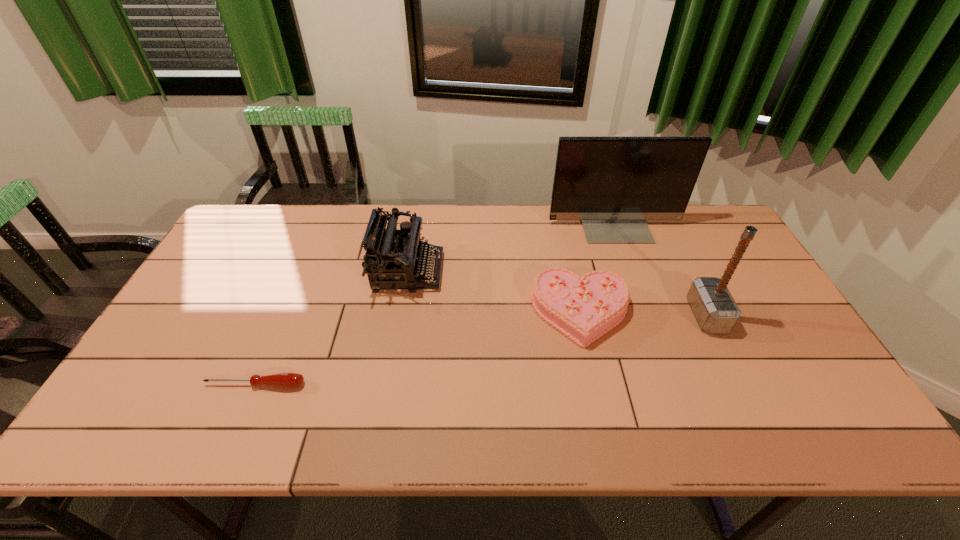
Where is `free point between the hammer and the shortest object`? This screenshot has width=960, height=540. free point between the hammer and the shortest object is located at coordinates (481, 350).

Where is `vacant area between the computer monitor and the typewriter`? The height and width of the screenshot is (540, 960). vacant area between the computer monitor and the typewriter is located at coordinates pos(511,247).

Where is `the third closest object to the computer monitor`? the third closest object to the computer monitor is located at coordinates (393, 258).

Image resolution: width=960 pixels, height=540 pixels. Find the location of `object that stands as the third closest to the third tallest object`. object that stands as the third closest to the third tallest object is located at coordinates (613, 185).

Locate an element on the screen. free point that satisfies the following two spatial constraints: 1. on the keyboard of the cake; 2. on the right side of the third tallest object is located at coordinates (400, 313).

Where is `vacant point that satisfies the following two spatial constraints: 1. on the keyboard of the fourth object from right to left; 2. on the front side of the screwdriver`? This screenshot has width=960, height=540. vacant point that satisfies the following two spatial constraints: 1. on the keyboard of the fourth object from right to left; 2. on the front side of the screwdriver is located at coordinates (388, 385).

Find the location of `vacant region that satisfies the following two spatial constraints: 1. on the keyboard of the typewriter; 2. on the back side of the fourth tallest object`. vacant region that satisfies the following two spatial constraints: 1. on the keyboard of the typewriter; 2. on the back side of the fourth tallest object is located at coordinates (400, 313).